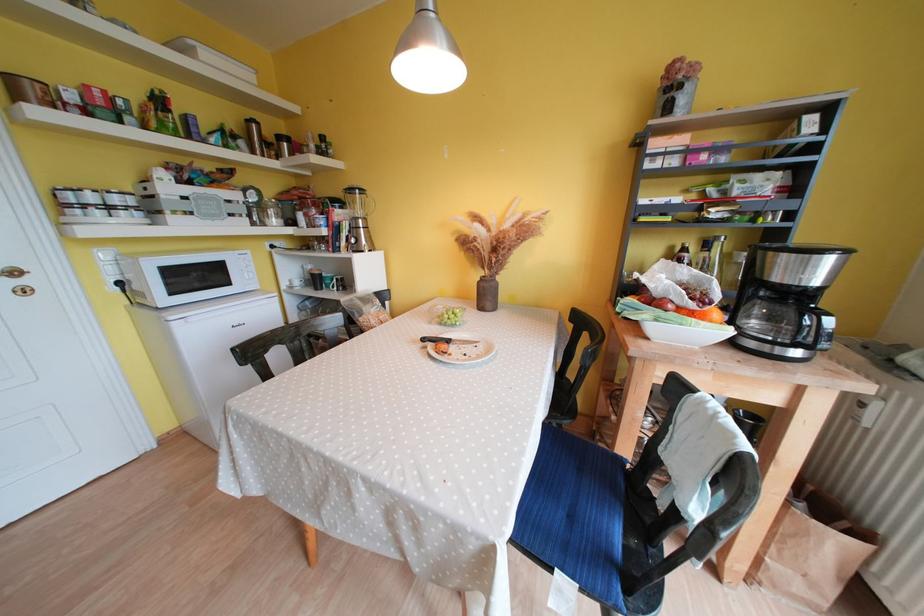
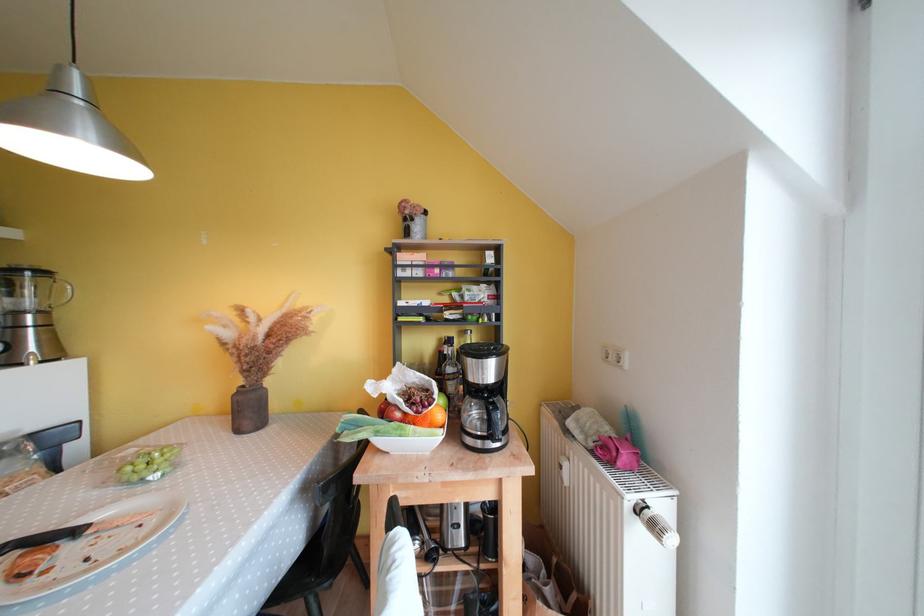
Question: I am providing you with two images of the same scene from different viewpoints. After the viewpoint changes to image2, which objects are now occluded?

Choices:
 (A) chair sitting surface
 (B) plastic grape container
 (C) white ceramic bowl
 (D) none of these

Answer: (D)